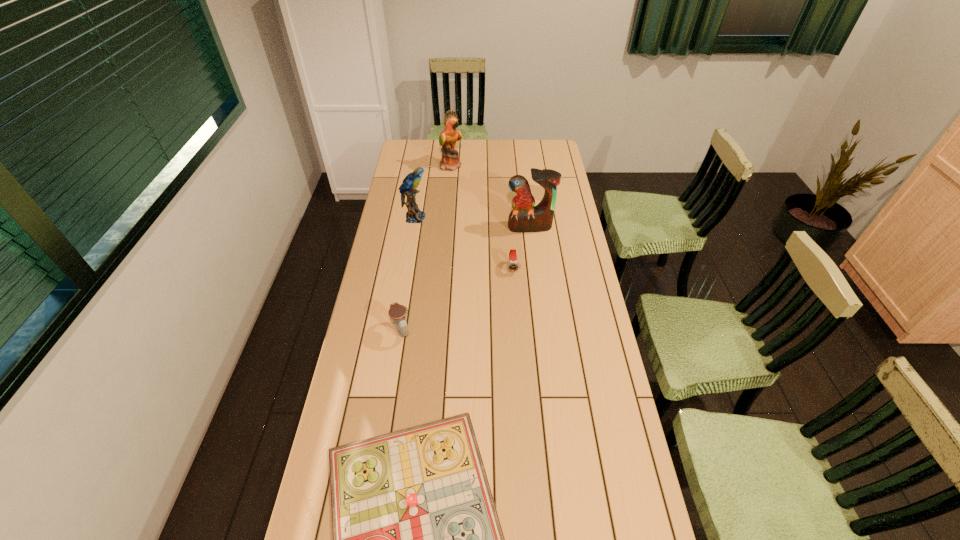
Find the location of a particular element. The height and width of the screenshot is (540, 960). the second parrot from left to right is located at coordinates pyautogui.click(x=450, y=161).

You are a GUI agent. You are given a task and a screenshot of the screen. Output one action in this format:
    pyautogui.click(x=<x>, y=<y>)
    Task: Click on the farthest parrot
    
    Given the screenshot: What is the action you would take?
    pyautogui.click(x=450, y=161)

The image size is (960, 540). Identify the location of the rightmost parrot. (525, 217).

At what (x,y) coordinates should I click in order to perform the action: click on the leftmost parrot. Please return your answer as a coordinate pair (x, y). The image size is (960, 540). Looking at the image, I should click on (408, 187).

Find the location of a particular element. The image size is (960, 540). the left watch is located at coordinates (397, 312).

Image resolution: width=960 pixels, height=540 pixels. I want to click on the taller watch, so pyautogui.click(x=397, y=312).

This screenshot has width=960, height=540. Find the location of `the right watch`. the right watch is located at coordinates (513, 265).

At what (x,y) coordinates should I click in order to perform the action: click on the shorter watch. Please return your answer as a coordinate pair (x, y). Looking at the image, I should click on (513, 265).

Locate an element on the screen. vacant region located 0.340m on the front-facing side of the farthest parrot is located at coordinates (530, 165).

Where is `free region located at the face of the rightmost parrot`? The image size is (960, 540). free region located at the face of the rightmost parrot is located at coordinates (535, 265).